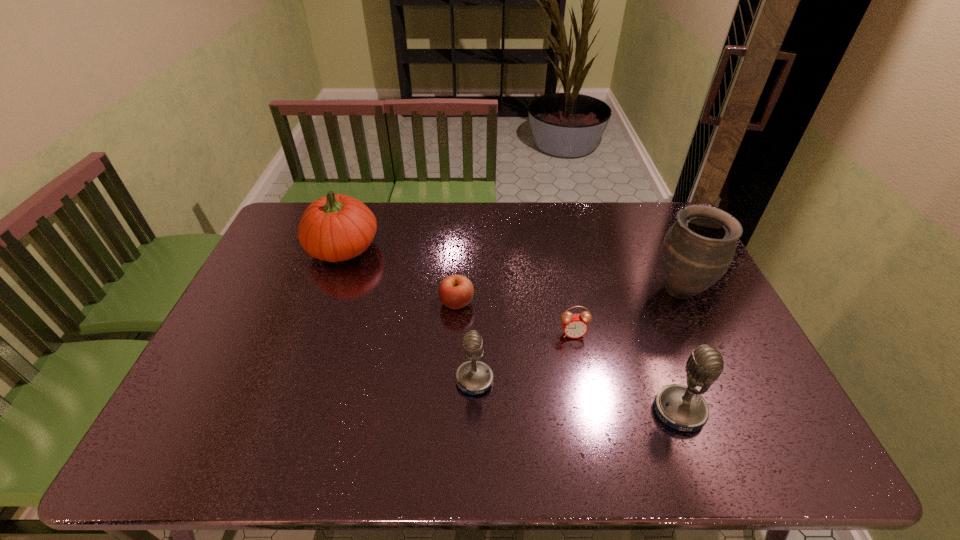
Where is `the left microphone`? Image resolution: width=960 pixels, height=540 pixels. the left microphone is located at coordinates [473, 377].

Identify the location of the shorter microphone. This screenshot has width=960, height=540. (473, 377).

Where is `the right microphone`? This screenshot has height=540, width=960. the right microphone is located at coordinates (681, 407).

Identify the location of apple. The height and width of the screenshot is (540, 960). (455, 291).

Identify the location of urn. 698,249.

At what (x,y) coordinates should I click in order to perform the action: click on pumpkin. Please return your answer as a coordinate pair (x, y). Looking at the image, I should click on (334, 228).

I want to click on the third nearest object, so click(574, 325).

This screenshot has height=540, width=960. Find the location of `the fourth object from left to right`. the fourth object from left to right is located at coordinates (574, 325).

This screenshot has width=960, height=540. In order to click on vacant space located on the front-facing side of the shorter microphone in this screenshot , I will do `click(376, 380)`.

Identify the location of vacant space situated 0.050m on the front-facing side of the shorter microphone. Image resolution: width=960 pixels, height=540 pixels. (436, 380).